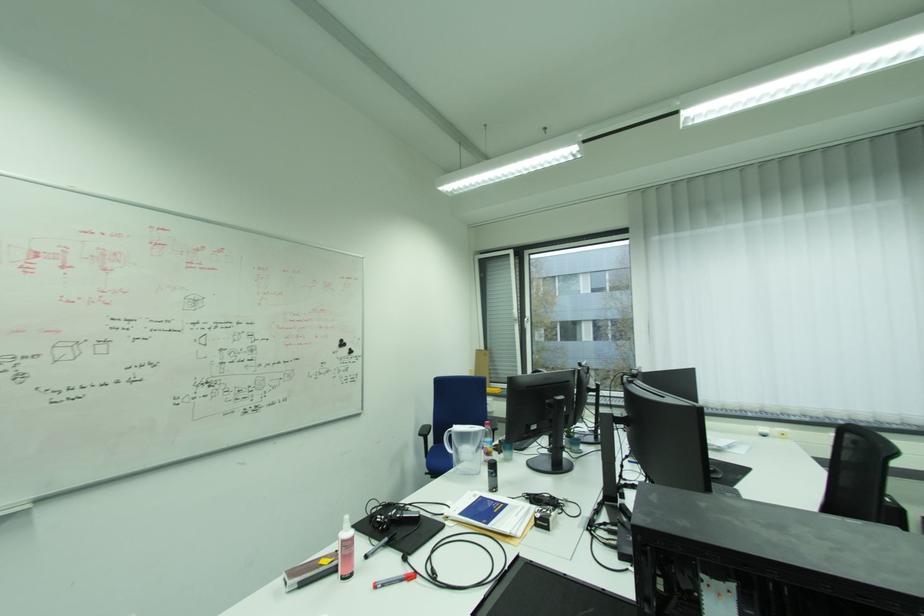
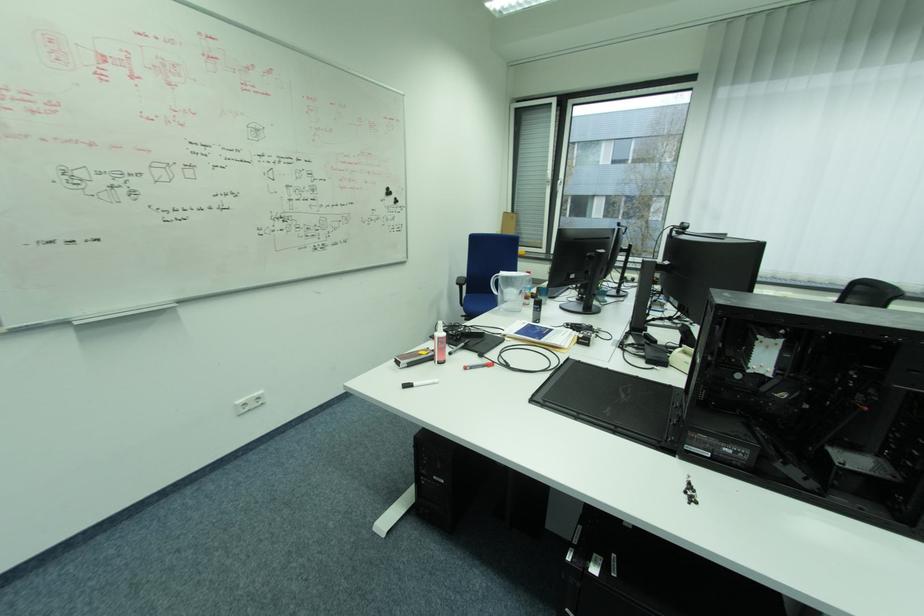
Which direction would the cameraman need to move to produce the second image?

The movement direction of the cameraman is left, backward.